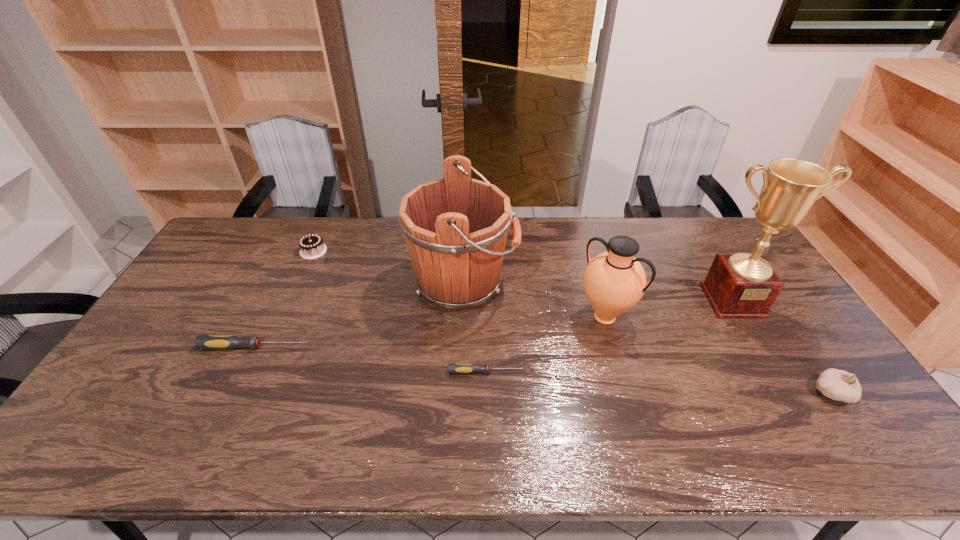
You are a GUI agent. You are given a task and a screenshot of the screen. Output one action in this format:
    pyautogui.click(x=<x>, y=<y>)
    Task: Click on the vacant space that satisfies the following two spatial constraints: 1. on the front side of the fourth shortest object; 2. on the left side of the pitcher
    This screenshot has height=540, width=960.
    Given the screenshot: What is the action you would take?
    (626, 393)

Locate an element on the screen. The width and height of the screenshot is (960, 540). free spot that satisfies the following two spatial constraints: 1. insert the farther screwdriver into a screw head; 2. on the right side of the nearest object is located at coordinates (233, 393).